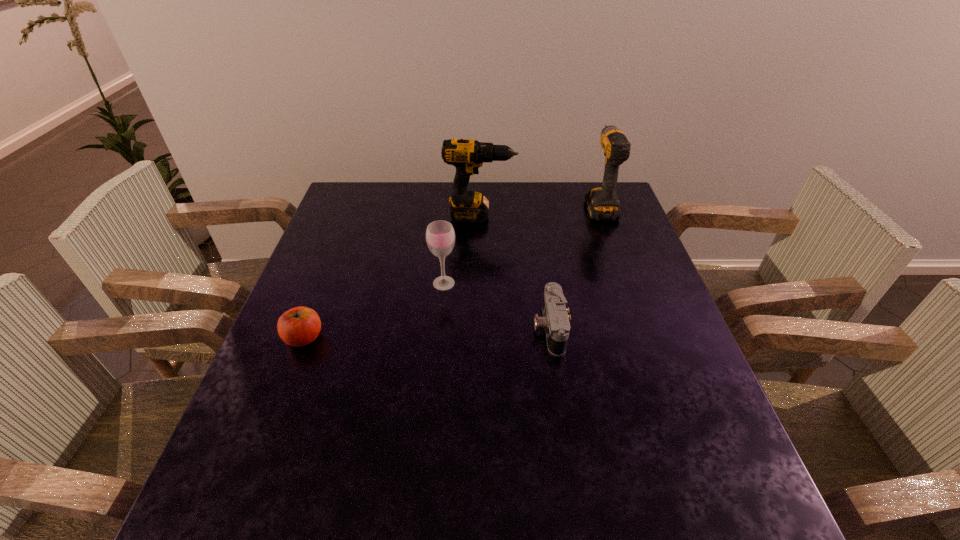
Where is `free space at the near left corner of the desktop`? Image resolution: width=960 pixels, height=540 pixels. free space at the near left corner of the desktop is located at coordinates point(283,497).

In the image, there is a desktop. At what (x,y) coordinates should I click in order to perform the action: click on vacant space at the far right corner. Please return your answer as a coordinate pair (x, y). The width and height of the screenshot is (960, 540). Looking at the image, I should click on click(578, 186).

Locate an element on the screen. Image resolution: width=960 pixels, height=540 pixels. free space at the near right corner of the desktop is located at coordinates (684, 485).

Find the location of a particular element. Image resolution: width=960 pixels, height=540 pixels. free spot between the apple and the wineglass is located at coordinates (374, 310).

This screenshot has height=540, width=960. I want to click on free area in between the third farthest object and the leftmost object, so click(x=374, y=310).

The width and height of the screenshot is (960, 540). I want to click on free space between the camera and the left drill, so click(x=515, y=272).

This screenshot has width=960, height=540. I want to click on vacant area that lies between the second object from right to left and the rightmost object, so click(x=574, y=266).

At what (x,y) coordinates should I click in order to perform the action: click on unoccupied area between the right drill and the apple. Please return your answer as a coordinate pair (x, y). Looking at the image, I should click on (452, 272).

Where is `vacant area that lies between the left drill and the apple`? Image resolution: width=960 pixels, height=540 pixels. vacant area that lies between the left drill and the apple is located at coordinates (392, 277).

Locate an element on the screen. The width and height of the screenshot is (960, 540). free space between the third shortest object and the fourth object from left to right is located at coordinates (496, 306).